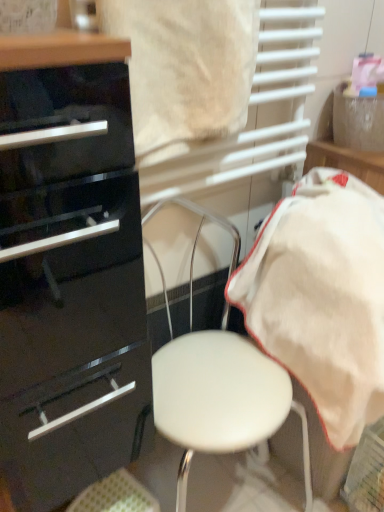
Question: Considering the relative positions of glossy black chest of drawers at left and white cotton towel at right in the image provided, is glossy black chest of drawers at left in front of white cotton towel at right?

Choices:
 (A) yes
 (B) no

Answer: (A)

Question: Considering the relative sizes of glossy black chest of drawers at left and white cotton towel at right in the image provided, is glossy black chest of drawers at left shorter than white cotton towel at right?

Choices:
 (A) yes
 (B) no

Answer: (B)

Question: Is glossy black chest of drawers at left smaller than white cotton towel at right?

Choices:
 (A) no
 (B) yes

Answer: (B)

Question: Are glossy black chest of drawers at left and white cotton towel at right beside each other?

Choices:
 (A) yes
 (B) no

Answer: (B)

Question: From a real-world perspective, does glossy black chest of drawers at left sit lower than white cotton towel at right?

Choices:
 (A) no
 (B) yes

Answer: (A)

Question: From a real-world perspective, is glossy black chest of drawers at left located higher than white cotton towel at right?

Choices:
 (A) no
 (B) yes

Answer: (B)

Question: Is white cotton towel at right next to white leather stool at center?

Choices:
 (A) no
 (B) yes

Answer: (A)

Question: From a real-world perspective, is white cotton towel at right physically above white leather stool at center?

Choices:
 (A) yes
 (B) no

Answer: (A)

Question: From the image's perspective, is white cotton towel at right under white leather stool at center?

Choices:
 (A) yes
 (B) no

Answer: (B)

Question: Can you confirm if white cotton towel at right is wider than white leather stool at center?

Choices:
 (A) yes
 (B) no

Answer: (A)

Question: Is white cotton towel at right oriented away from white leather stool at center?

Choices:
 (A) yes
 (B) no

Answer: (B)

Question: From the image's perspective, is white cotton towel at right above white leather stool at center?

Choices:
 (A) yes
 (B) no

Answer: (A)

Question: Is white cotton towel at right located outside glossy black chest of drawers at left?

Choices:
 (A) yes
 (B) no

Answer: (A)